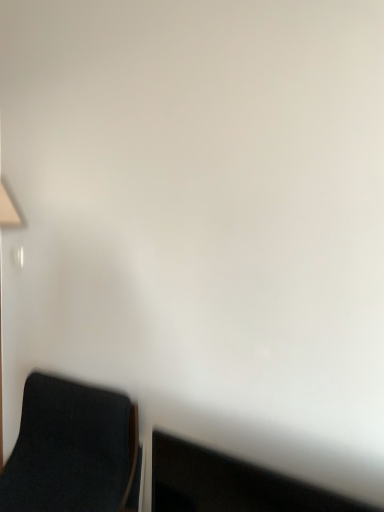
The image size is (384, 512). What do you see at coordinates (71, 450) in the screenshot? I see `dark fabric chair at lower left` at bounding box center [71, 450].

This screenshot has width=384, height=512. I want to click on dark fabric chair at lower left, so click(71, 450).

Image resolution: width=384 pixels, height=512 pixels. I want to click on dark fabric chair at lower left, so click(x=71, y=450).